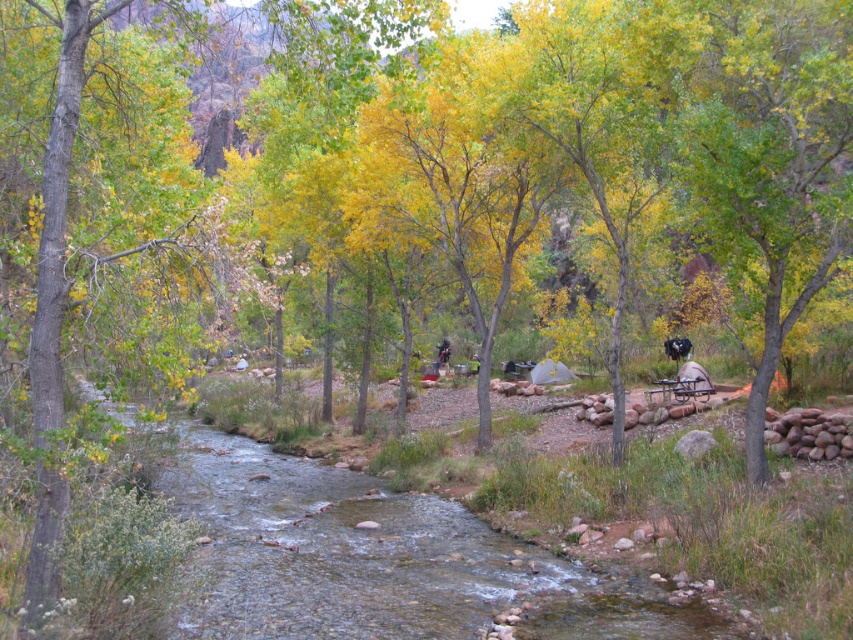
Question: Which object is closer to the camera taking this photo?

Choices:
 (A) clear water stream at center
 (B) dark blue jeans at center

Answer: (A)

Question: Which point appears farthest from the camera in this image?

Choices:
 (A) (300, 512)
 (B) (450, 353)

Answer: (B)

Question: Is clear water stream at center behind dark blue jeans at center?

Choices:
 (A) yes
 (B) no

Answer: (B)

Question: Does clear water stream at center have a lesser width compared to dark blue jeans at center?

Choices:
 (A) no
 (B) yes

Answer: (A)

Question: Which of the following is the farthest from the observer?

Choices:
 (A) dark blue jeans at center
 (B) clear water stream at center

Answer: (A)

Question: Is clear water stream at center positioned at the back of dark blue jeans at center?

Choices:
 (A) no
 (B) yes

Answer: (A)